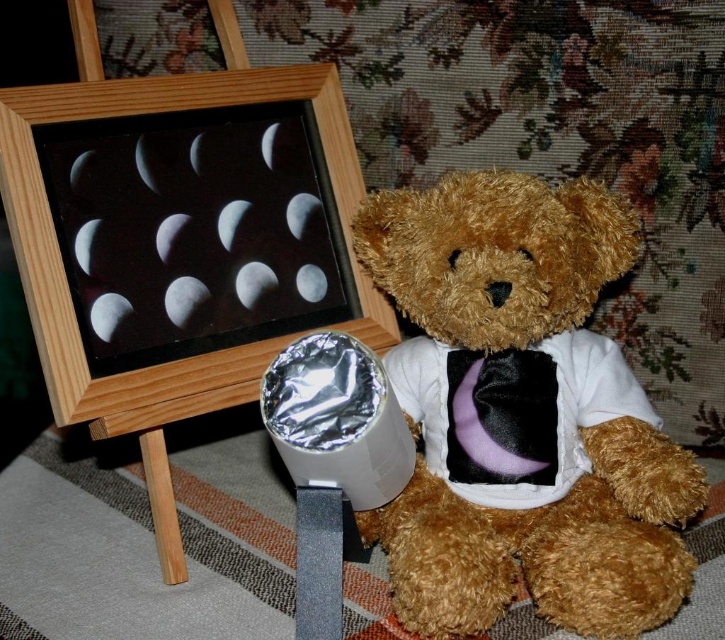
Can you confirm if fuzzy brown teddy bear at center is taller than wooden picture frame at left?

No, fuzzy brown teddy bear at center is not taller than wooden picture frame at left.

Who is taller, fuzzy brown teddy bear at center or wooden picture frame at left?

wooden picture frame at left

What do you see at coordinates (522, 413) in the screenshot? The image size is (725, 640). I see `fuzzy brown teddy bear at center` at bounding box center [522, 413].

The image size is (725, 640). What are the coordinates of `fuzzy brown teddy bear at center` in the screenshot? It's located at (522, 413).

Between fuzzy brown teddy bear at center and purple velvet tie at center, which one has less height?

purple velvet tie at center is shorter.

Is point (587, 515) positioned before point (526, 426)?

That is True.

Does point (455, 410) come farther from viewer compared to point (455, 404)?

Yes, it is behind point (455, 404).

Locate an element on the screen. fuzzy brown teddy bear at center is located at coordinates (522, 413).

Between point (130, 387) and point (515, 387), which one is positioned behind?

The point (515, 387) is more distant.

Is wooden picture frame at left to the right of purple velvet tie at center from the viewer's perspective?

No, wooden picture frame at left is not to the right of purple velvet tie at center.

Which is in front, point (312, 109) or point (468, 417)?

Point (468, 417) is more forward.

Find the location of a particular element. This screenshot has width=725, height=640. wooden picture frame at left is located at coordinates (181, 358).